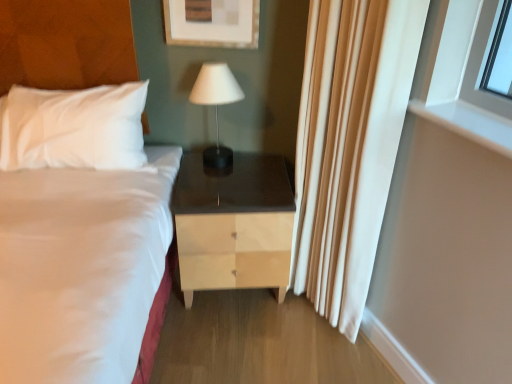
Question: From a real-world perspective, relative to light wood/finish nightstand at center, is white matte table lamp at center vertically above or below?

Choices:
 (A) above
 (B) below

Answer: (A)

Question: Based on their sizes in the image, would you say white matte table lamp at center is bigger or smaller than light wood/finish nightstand at center?

Choices:
 (A) big
 (B) small

Answer: (B)

Question: Which object is positioned farthest from the white glossy window at upper right?

Choices:
 (A) light wood/finish nightstand at center
 (B) white matte table lamp at center
 (C) white silky curtain at right

Answer: (B)

Question: Which is nearer to the white matte table lamp at center?

Choices:
 (A) light wood/finish nightstand at center
 (B) white glossy window at upper right
 (C) white silky curtain at right

Answer: (A)